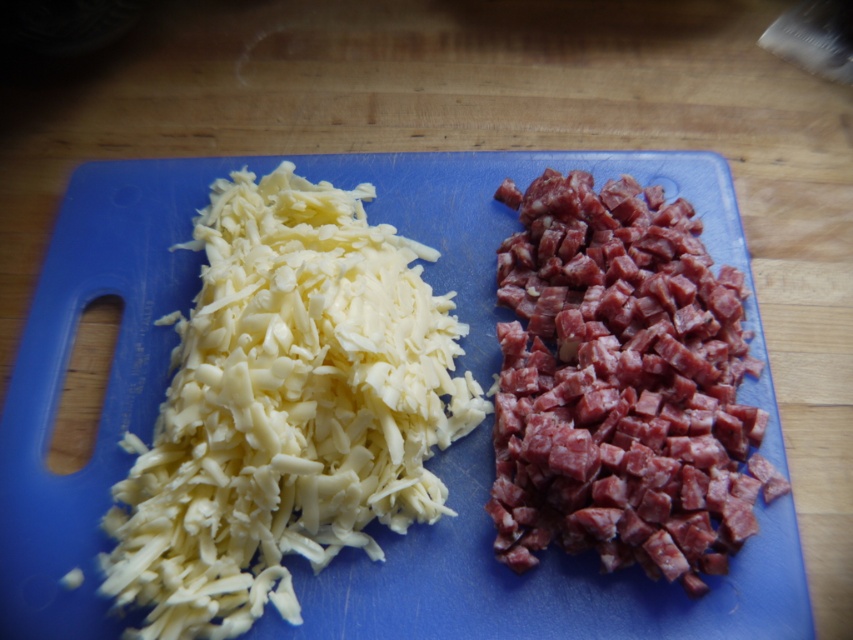
Is white shredded cheese at left shorter than pinkish-red meat at right?

No, white shredded cheese at left is not shorter than pinkish-red meat at right.

Which of these two, white shredded cheese at left or pinkish-red meat at right, stands shorter?

Standing shorter between the two is pinkish-red meat at right.

Locate an element on the screen. white shredded cheese at left is located at coordinates (285, 406).